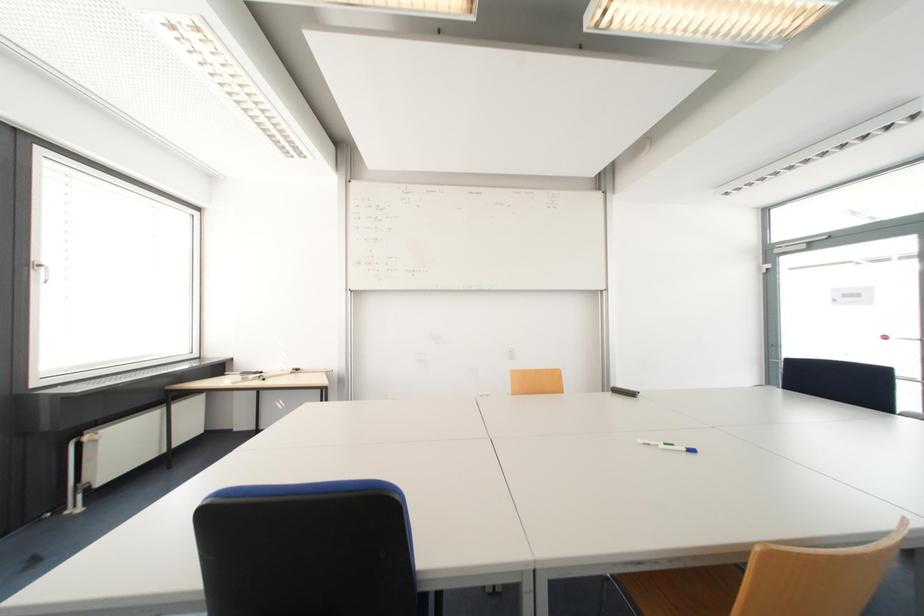
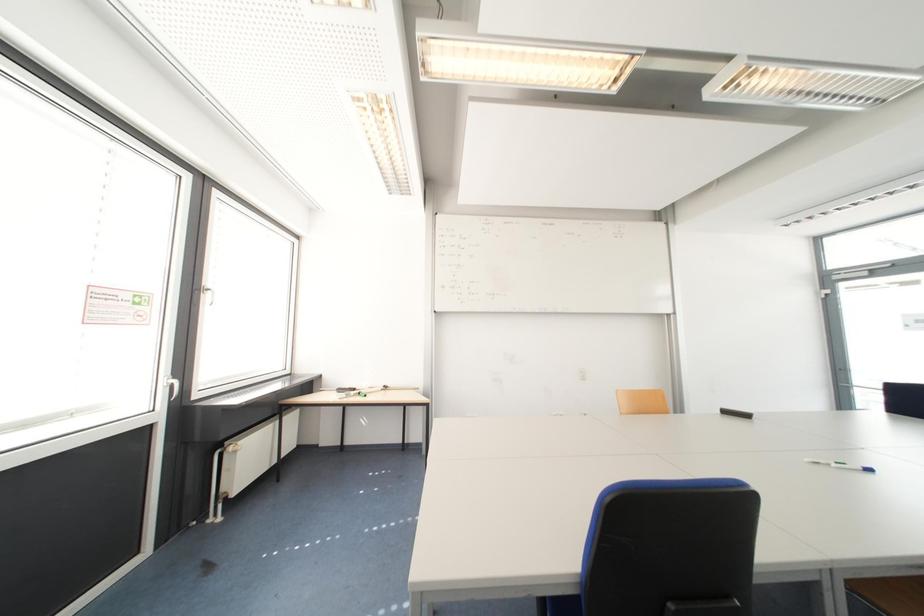
Question: The images are taken continuously from a first-person perspective. In which direction is your viewpoint rotating?

Choices:
 (A) Left
 (B) Right
 (C) Up
 (D) Down

Answer: (C)